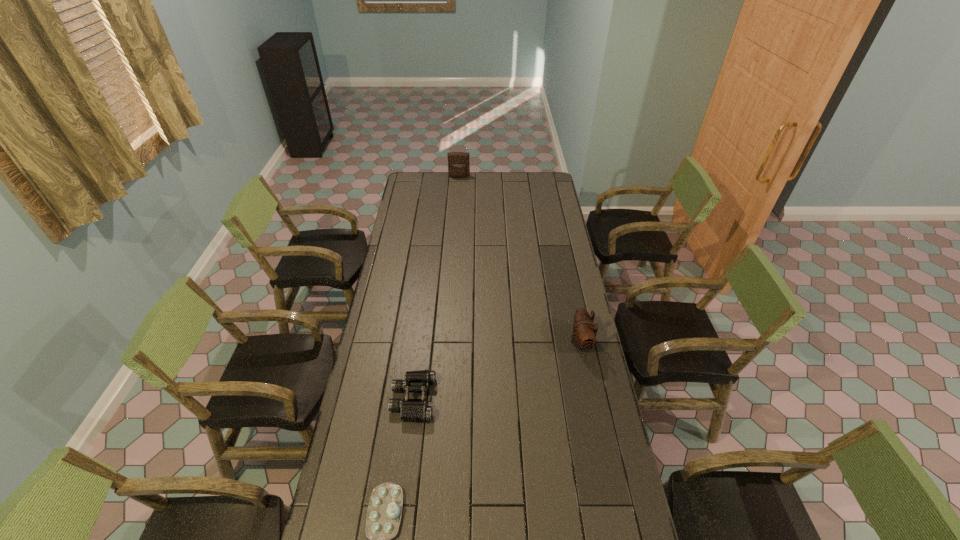
At what (x,y) coordinates should I click in order to perform the action: click on object that stands as the third closest to the nearer pouch. Please return your answer as a coordinate pair (x, y). This screenshot has width=960, height=540. Looking at the image, I should click on (458, 162).

Choose which object is the nearest neighbor to the rightmost object. Please provide its 2D coordinates. Your answer should be formatted as a tuple, i.e. [(x, y)], where the tuple contains the x and y coordinates of a point satisfying the conditions above.

[(418, 410)]